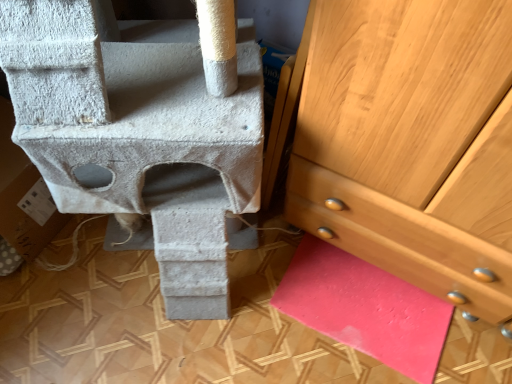
Locate an element on the screen. This screenshot has height=384, width=512. vacant space underneath pink felt bath mat at lower right (from a real-world perspective) is located at coordinates (360, 312).